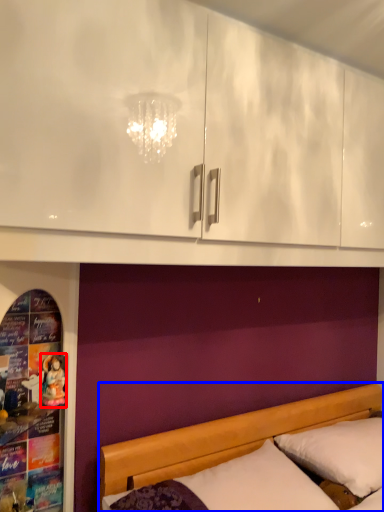
Question: Which object appears closest to the camera in this image, doll (highlighted by a red box) or bed (highlighted by a blue box)?

Choices:
 (A) doll
 (B) bed

Answer: (B)